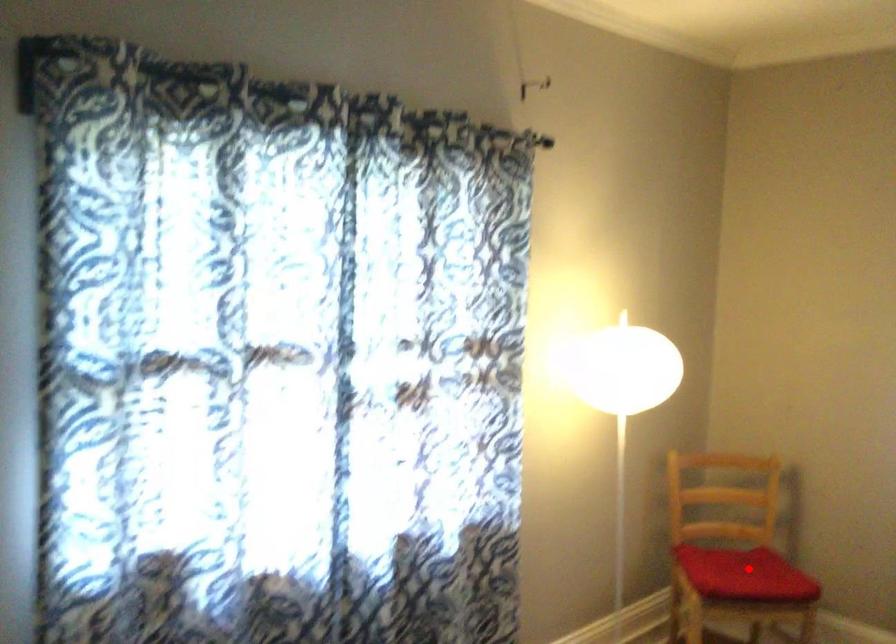
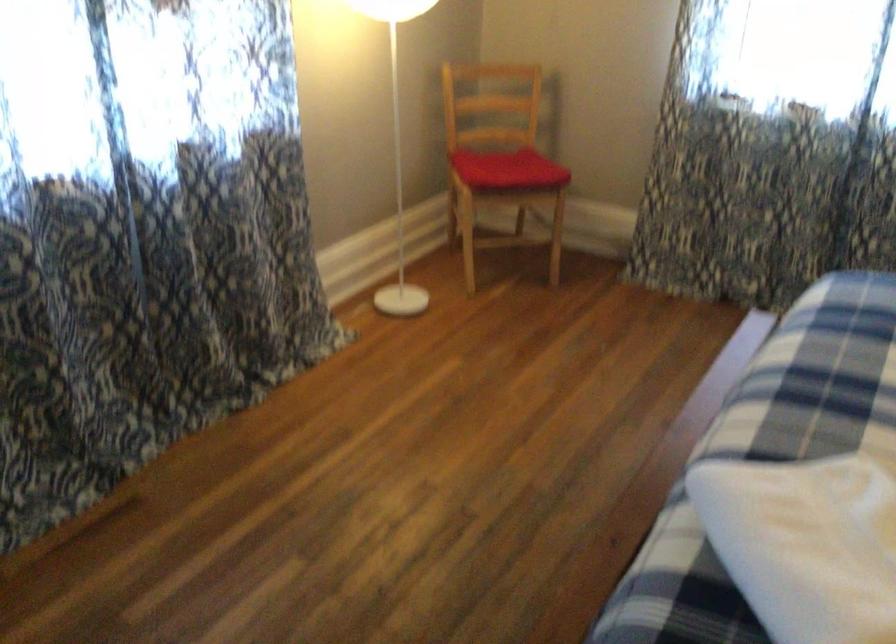
Where in the second image is the point corresponding to the highlighted location from the first image?

(507, 169)